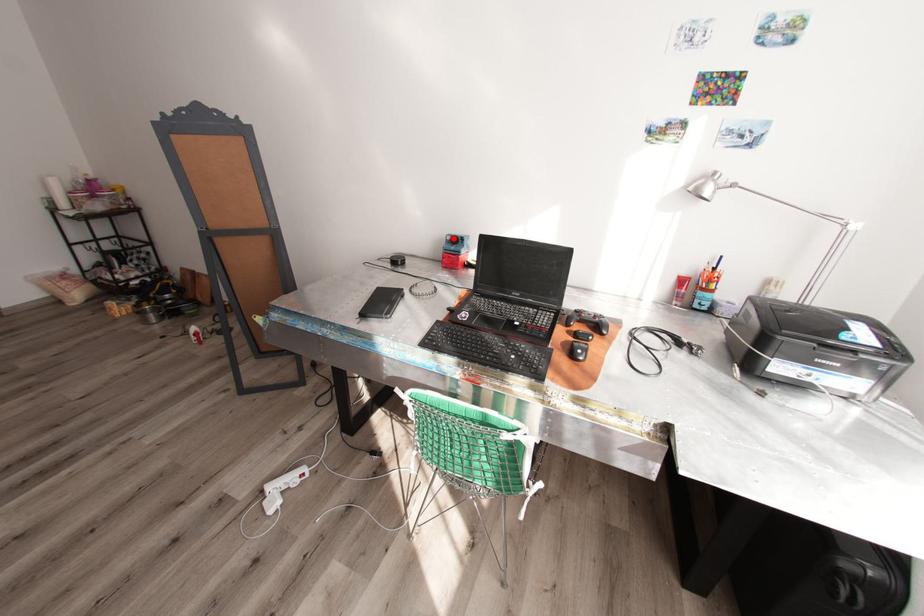
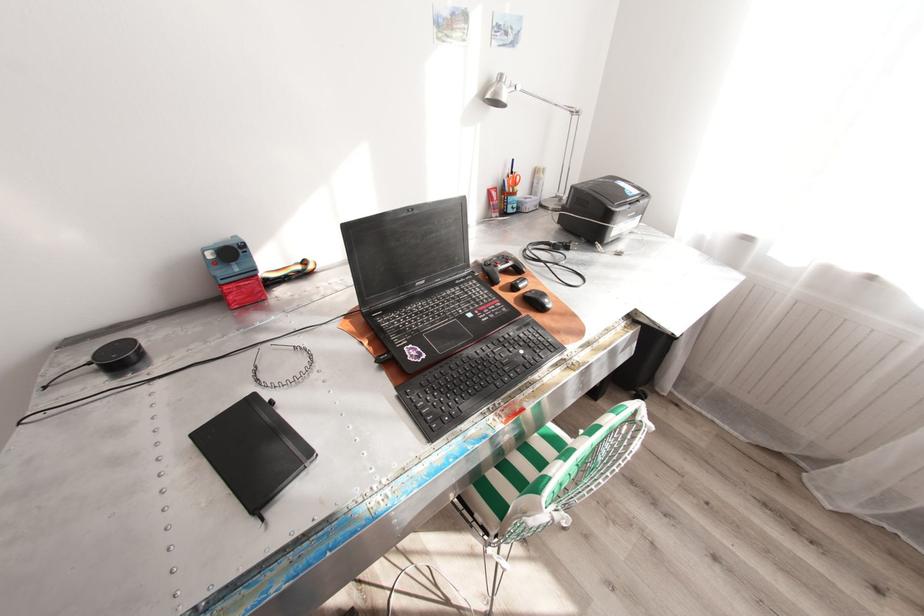
In the second image, find the point that corresponds to the highlighted location in the first image.

(215, 254)